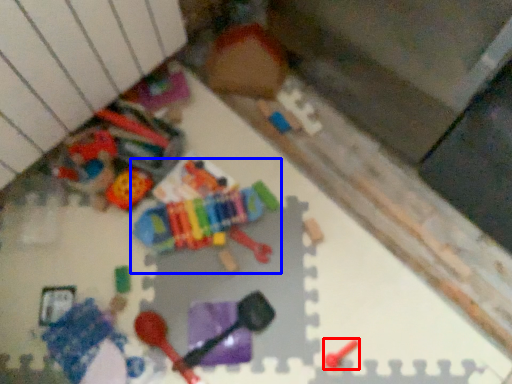
Question: Which point is further to the camera, toy (highlighted by a red box) or toy (highlighted by a blue box)?

Choices:
 (A) toy
 (B) toy

Answer: (B)